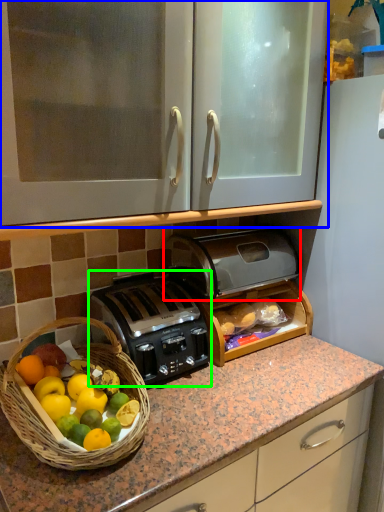
Question: Estimate the real-world distances between objects in this image. Which object is farther from toaster (highlighted by a red box), cabinetry (highlighted by a blue box) or toaster (highlighted by a green box)?

Choices:
 (A) cabinetry
 (B) toaster

Answer: (A)